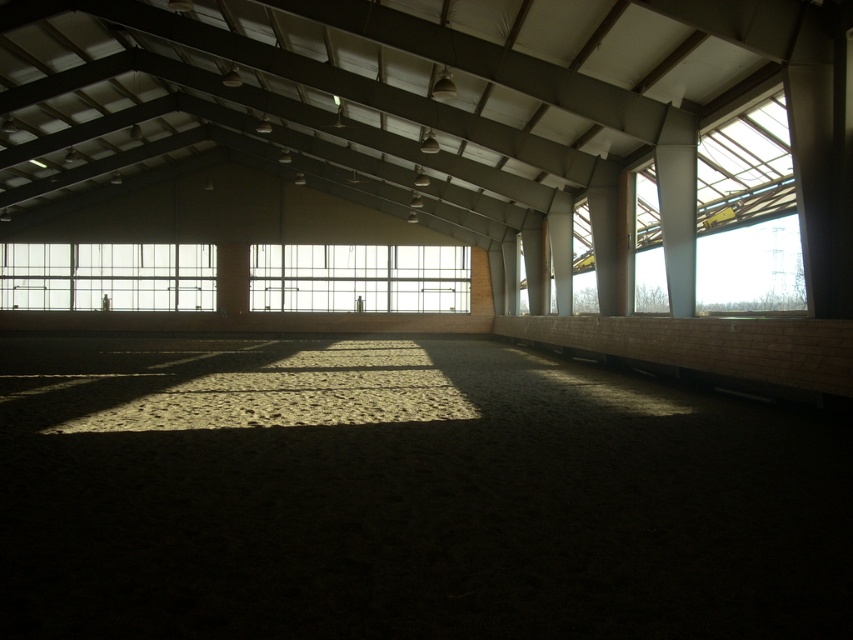
Question: Which point appears closest to the camera in this image?

Choices:
 (A) (648, 307)
 (B) (462, 284)
 (C) (201, 288)

Answer: (A)

Question: Is transparent glass window at upper right positioned before clear glass window at upper left?

Choices:
 (A) no
 (B) yes

Answer: (B)

Question: Is clear glass window at center below clear glass window at upper left?

Choices:
 (A) no
 (B) yes

Answer: (A)

Question: Which point is closer to the camera taking this photo?

Choices:
 (A) (376, 284)
 (B) (780, 284)

Answer: (B)

Question: Which object is closer to the camera taking this photo?

Choices:
 (A) clear glass window at center
 (B) clear glass window at upper left
 (C) transparent glass window at upper right

Answer: (C)

Question: Can you confirm if clear glass window at center is thinner than clear glass window at upper left?

Choices:
 (A) no
 (B) yes

Answer: (B)